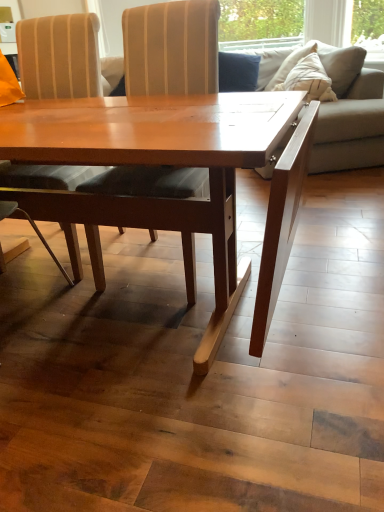
Locate an element on the screen. The width and height of the screenshot is (384, 512). free space on the front side of matte wood chair at center, which appears as the first chair when viewed from the left is located at coordinates (68, 298).